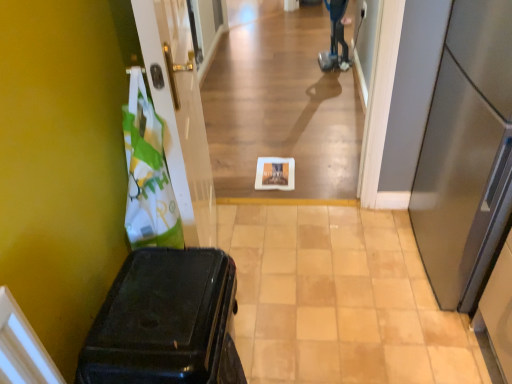
What are the coordinates of `free space that is to the left of blue plastic mobility scooter at upper center` in the screenshot? It's located at (305, 64).